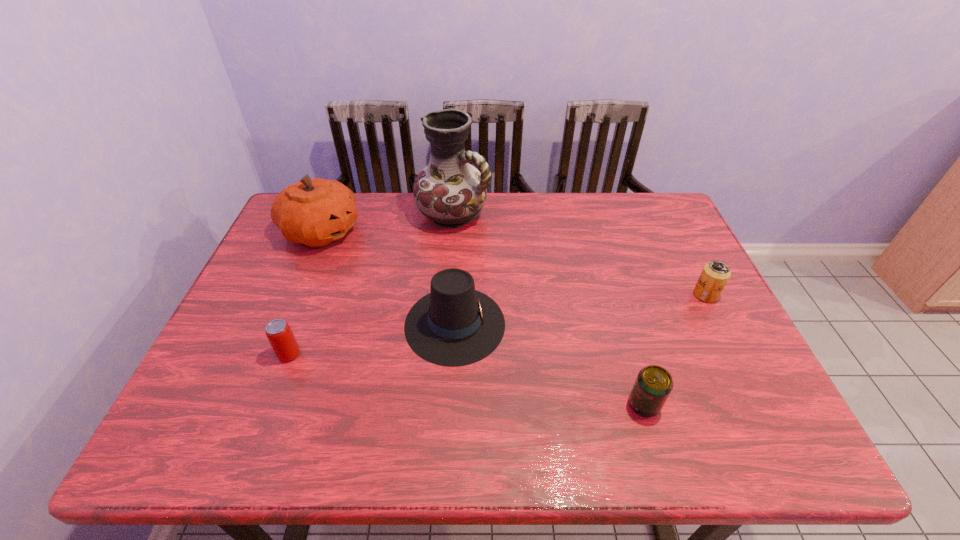
This screenshot has height=540, width=960. Find the location of `blank space that satisfies the following two spatial constraints: 1. on the back side of the fifth object from left to right; 2. on the front-facing side of the pumpkin`. blank space that satisfies the following two spatial constraints: 1. on the back side of the fifth object from left to right; 2. on the front-facing side of the pumpkin is located at coordinates (593, 231).